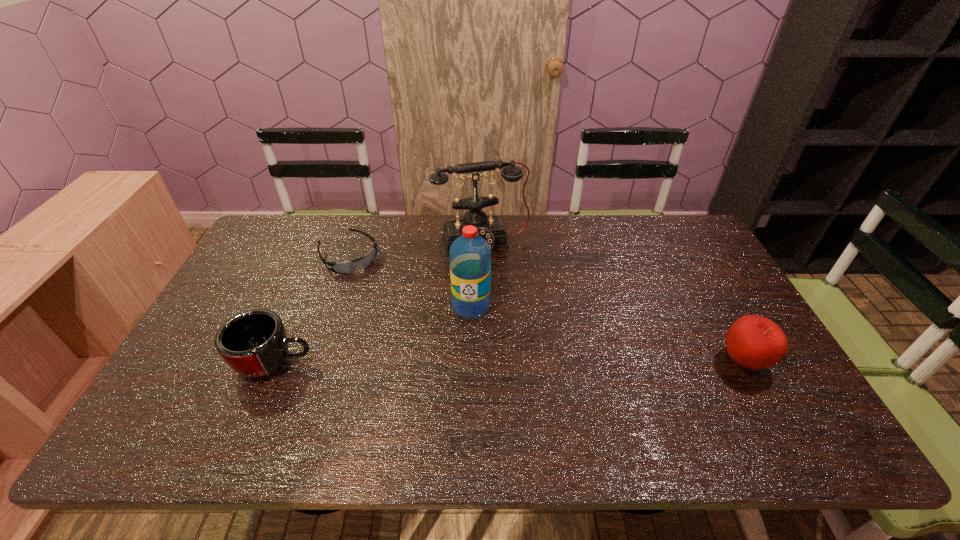
At what (x,y) coordinates should I click in order to perform the action: click on vacant area situated 0.170m on the lenses of the sunglasses. Please return your answer as a coordinate pair (x, y). Looking at the image, I should click on (x=391, y=302).

This screenshot has width=960, height=540. Find the location of `free space located on the lenses of the sunglasses`. free space located on the lenses of the sunglasses is located at coordinates (391, 302).

Locate an element on the screen. vacant region located on the lenses of the sunglasses is located at coordinates (410, 323).

You are a GUI agent. You are given a task and a screenshot of the screen. Output one action in this format:
    pyautogui.click(x=<x>, y=<y>)
    Task: Click on the vacant space located on the dial of the telephone
    
    Given the screenshot: What is the action you would take?
    pyautogui.click(x=519, y=333)

This screenshot has height=540, width=960. I want to click on free point located on the dial of the telephone, so click(x=523, y=343).

Where is `vacant area located 0.330m on the dial of the telephone`? Image resolution: width=960 pixels, height=540 pixels. vacant area located 0.330m on the dial of the telephone is located at coordinates (519, 333).

The width and height of the screenshot is (960, 540). I want to click on sunglasses that is at the far edge, so click(349, 267).

Find the location of a particular element. telephone present at the far edge is located at coordinates (491, 228).

I want to click on mug present at the near edge, so click(x=254, y=344).

You are a GUI agent. You are given a task and a screenshot of the screen. Output one action in this format:
    pyautogui.click(x=<x>, y=<y>)
    Task: Click on the apple situated at the near edge
    
    Given the screenshot: What is the action you would take?
    pyautogui.click(x=753, y=341)